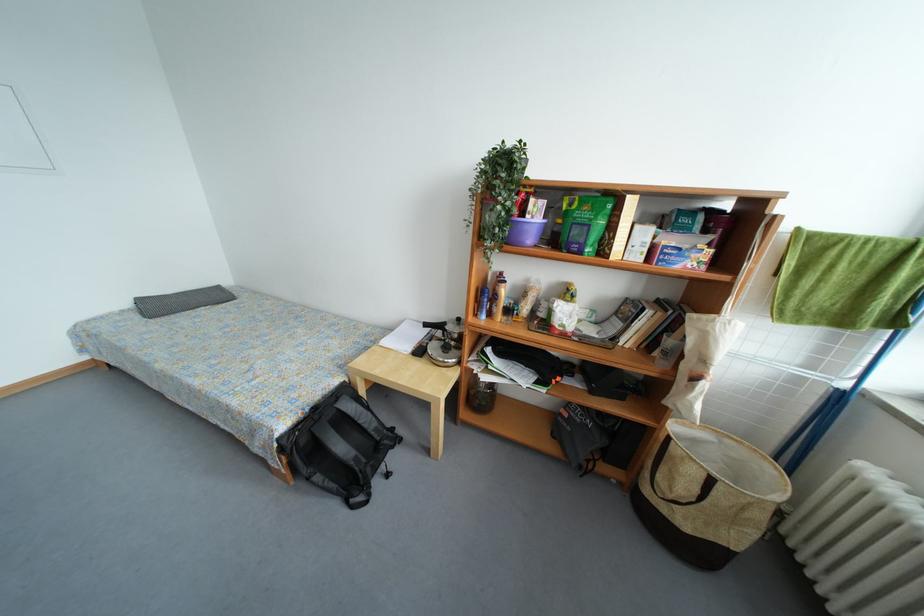
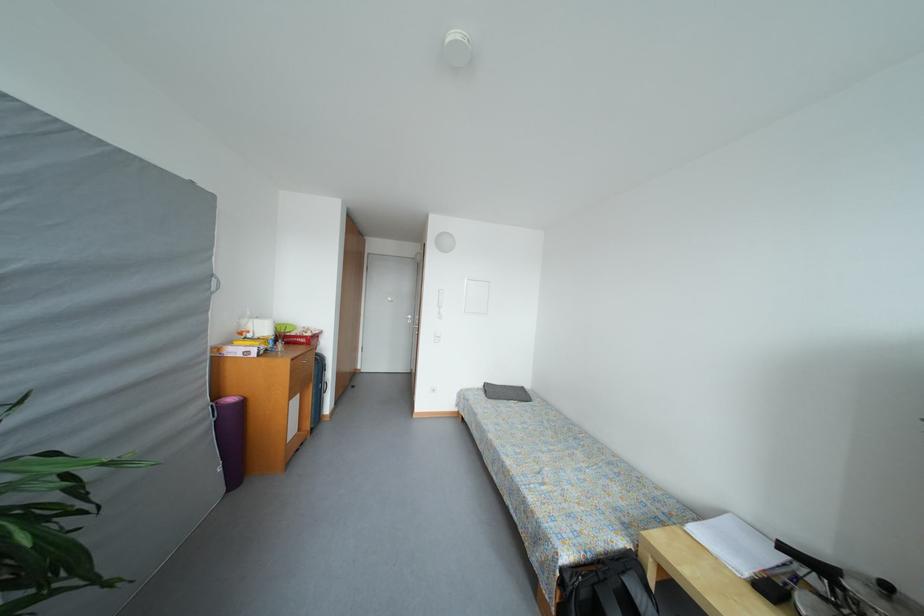
Find the pixel in the second image that matches (x=166, y=370) in the first image.

(496, 440)